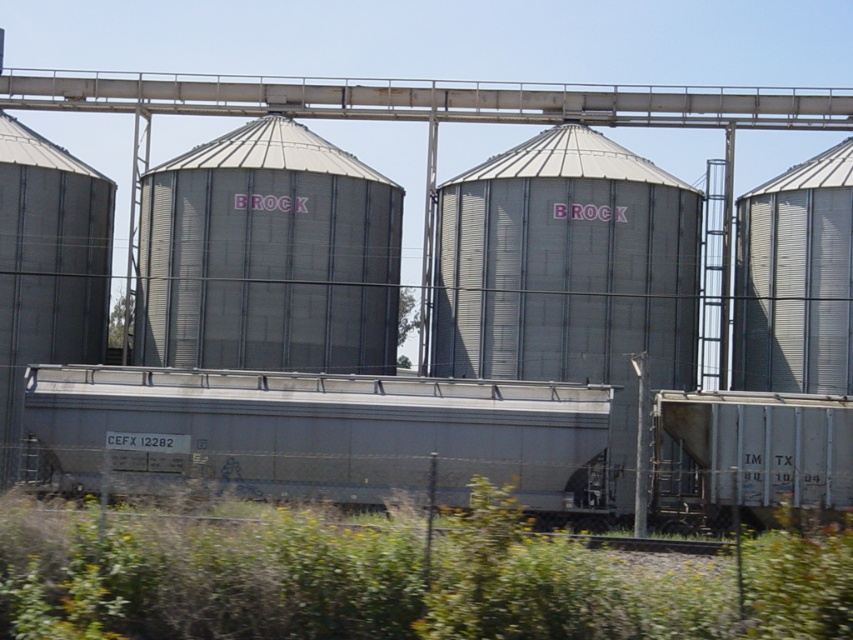
Can you confirm if silver metallic train car at center is bigger than metallic silver silo at right?

Yes.

Which is in front, point (492, 417) or point (851, 307)?

Point (492, 417)

I want to click on silver metallic train car at center, so (323, 435).

Does metallic gray silo at center have a greater width compared to metallic silver silo at right?

Correct, the width of metallic gray silo at center exceeds that of metallic silver silo at right.

Where is `metallic gray silo at center`? The image size is (853, 640). metallic gray silo at center is located at coordinates (268, 256).

Which is in front, point (268, 218) or point (793, 332)?

Point (793, 332) is in front.

Locate an element on the screen. metallic gray silo at center is located at coordinates (268, 256).

Is silver metallic train car at center to the left of metallic gray silo at center from the viewer's perspective?

No, silver metallic train car at center is not to the left of metallic gray silo at center.

Is silver metallic train car at center positioned behind metallic gray silo at center?

That is False.

The height and width of the screenshot is (640, 853). What do you see at coordinates (323, 435) in the screenshot?
I see `silver metallic train car at center` at bounding box center [323, 435].

Locate an element on the screen. silver metallic train car at center is located at coordinates (323, 435).